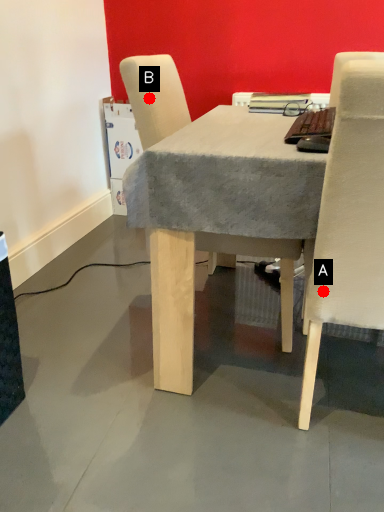
Question: Two points are circled on the image, labeled by A and B beside each circle. Which point is closer to the camera taking this photo?

Choices:
 (A) A is closer
 (B) B is closer

Answer: (A)